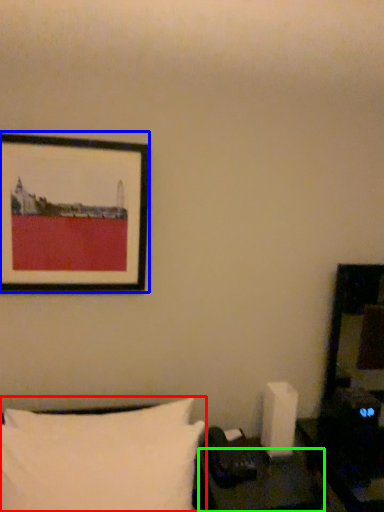
Question: Estimate the real-world distances between objects in this image. Which object is closer to pillow (highlighted by a red box), picture frame (highlighted by a blue box) or table (highlighted by a green box)?

Choices:
 (A) picture frame
 (B) table

Answer: (B)